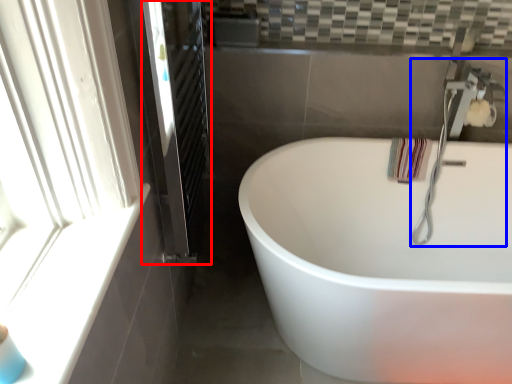
Question: Which point is further to the camera, screen door (highlighted by a red box) or faucet (highlighted by a blue box)?

Choices:
 (A) screen door
 (B) faucet

Answer: (B)